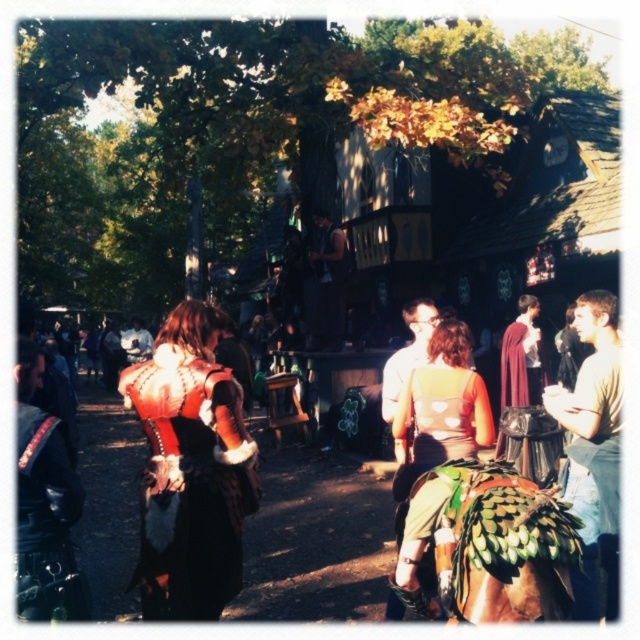
You are organizing a costume parade and need to arrange the green fabric dress at center and the leather jacket at left based on their sizes. Which costume should be placed first if you want to arrange them from largest to smallest?

The green fabric dress at center should be placed first because it has a larger size compared to the leather jacket at left.

You are navigating through a medieval festival and need to locate two points marked on a map. The first point is at coordinates point [584,465] and the second is at point [19,474]. Which point is closer to you as you stand at the festival entrance?

Point [584,465] is closer to you because it is further to the viewer than point [19,474].